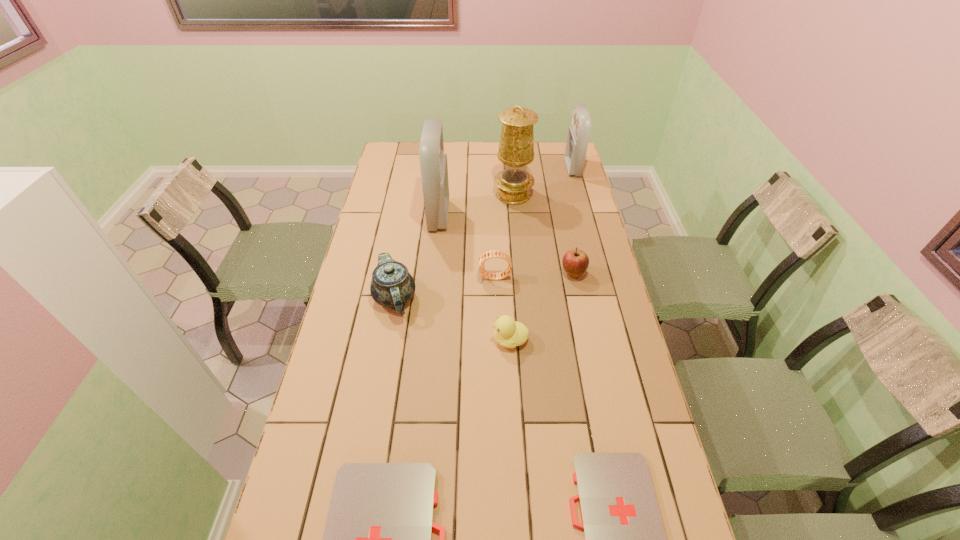
Where is `the fourth closest object relative to the oil lamp`? The height and width of the screenshot is (540, 960). the fourth closest object relative to the oil lamp is located at coordinates (487, 255).

Locate which first-aid kit is the closest to the chinaware. Please provide its 2D coordinates. Your answer should be formatted as a tuple, i.e. [(x, y)], where the tuple contains the x and y coordinates of a point satisfying the conditions above.

[(433, 162)]

Where is `the first-aid kit object that ranks as the second closest to the seventh farthest object`? This screenshot has height=540, width=960. the first-aid kit object that ranks as the second closest to the seventh farthest object is located at coordinates (377, 539).

This screenshot has height=540, width=960. Identify the location of vacant space that satisfies the following two spatial constraints: 1. on the back side of the apple; 2. on the front-facing side of the nearer red first-aid kit. (562, 216).

At what (x,y) coordinates should I click in order to perform the action: click on vacant position in the image that satisfies the following two spatial constraints: 1. on the back side of the red apple; 2. on the front-facing side of the bigger red first-aid kit. Please return your answer as a coordinate pair (x, y). Looking at the image, I should click on (562, 216).